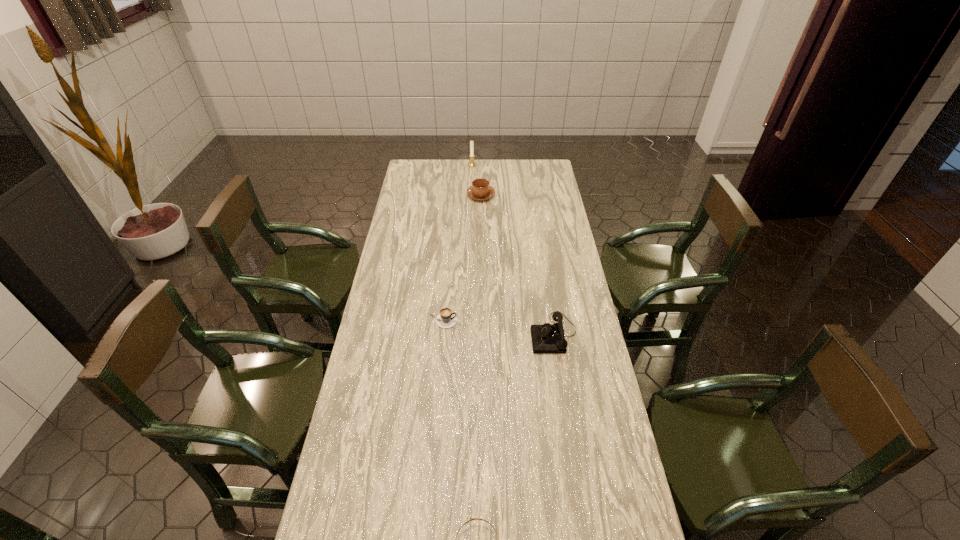
The image size is (960, 540). What are the coordinates of `blank space located on the front face of the rightmost object` in the screenshot? It's located at (455, 334).

Find the location of a particular element. The width and height of the screenshot is (960, 540). free space located on the front face of the rightmost object is located at coordinates (511, 334).

You are a GUI agent. You are given a task and a screenshot of the screen. Output one action in this format:
    pyautogui.click(x=<x>, y=<y>)
    Task: Click on the vacant space situated 0.220m on the side of the second farthest object with the handle
    
    Given the screenshot: What is the action you would take?
    pyautogui.click(x=481, y=167)

Where is `vacant area located on the side of the second farthest object with the handle`? vacant area located on the side of the second farthest object with the handle is located at coordinates (481, 171).

Identify the location of free space located 0.050m on the side of the second farthest object with the handle. (481, 183).

Image resolution: width=960 pixels, height=540 pixels. Identify the location of free space located 0.270m with the handle on the side of the fourth tallest object. (531, 321).

The height and width of the screenshot is (540, 960). I want to click on object at the far edge, so click(471, 164).

Image resolution: width=960 pixels, height=540 pixels. Identify the location of object that is at the right edge. (x=548, y=338).

Where is `vacant space at the far edge of the desktop`? vacant space at the far edge of the desktop is located at coordinates (453, 178).

Identify the location of blank area at the left edge. (407, 264).